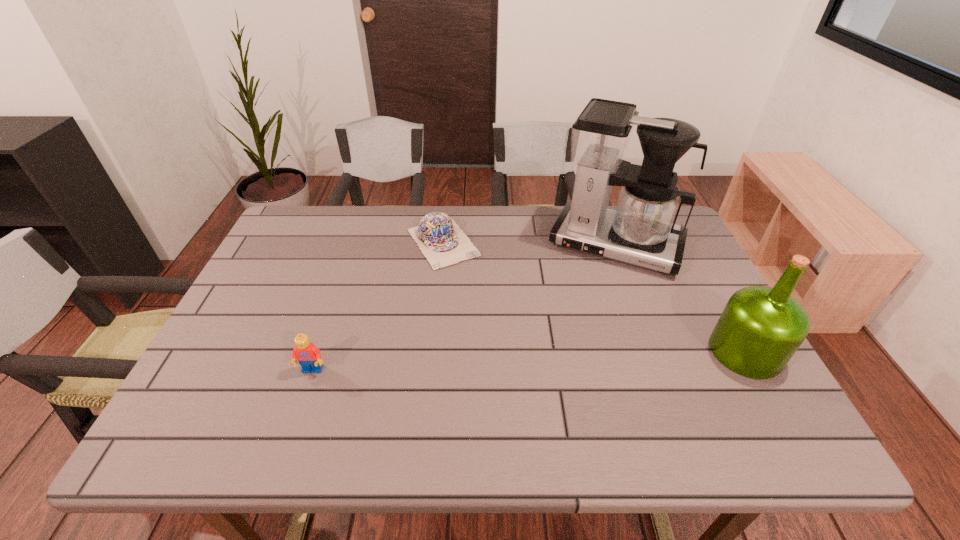
The height and width of the screenshot is (540, 960). I want to click on vacant space positioned at the front of the coffee maker where the controls are located, so click(588, 303).

Find the location of a particular element. The width and height of the screenshot is (960, 540). free space located on the front, side, and top of the shortest object is located at coordinates (534, 372).

Where is `blank space located on the front, side, and top of the shortest object`? Image resolution: width=960 pixels, height=540 pixels. blank space located on the front, side, and top of the shortest object is located at coordinates (492, 314).

Find the location of `free spot located 0.100m on the front, side, and top of the shortest object`. free spot located 0.100m on the front, side, and top of the shortest object is located at coordinates (474, 289).

Find the location of a particular element. The image size is (960, 540). coffee maker that is at the far edge is located at coordinates (641, 231).

Locate an element on the screen. The width and height of the screenshot is (960, 540). cap positioned at the far edge is located at coordinates (442, 242).

Locate an element on the screen. This screenshot has width=960, height=540. Lego present at the near edge is located at coordinates (308, 355).

Identify the location of olive oil positioned at the near edge. Image resolution: width=960 pixels, height=540 pixels. (760, 329).

Locate an element on the screen. This screenshot has height=540, width=960. olive oil at the right edge is located at coordinates (760, 329).

This screenshot has height=540, width=960. I want to click on coffee maker located at the right edge, so click(641, 231).